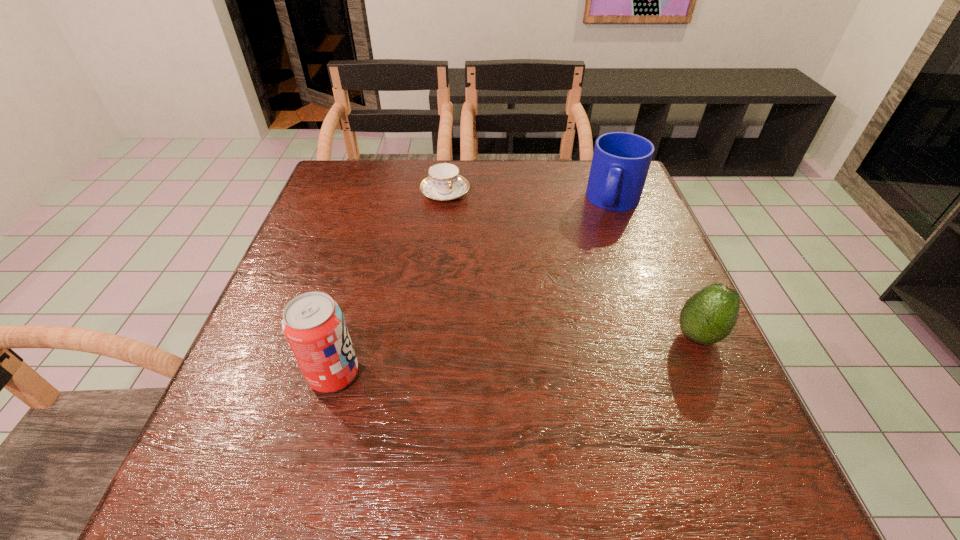
At what (x,y) coordinates should I click in order to perform the action: click on vacant spot on the desktop that is between the leftmost object and the avocado and is positioned on the side with the handle of the second object from left to right. Please return your answer as a coordinate pair (x, y). The width and height of the screenshot is (960, 540). Looking at the image, I should click on (537, 353).

This screenshot has height=540, width=960. In order to click on vacant spot on the desktop that is between the soda can and the avocado and is positioned on the side with the handle of the mug in this screenshot , I will do `click(560, 350)`.